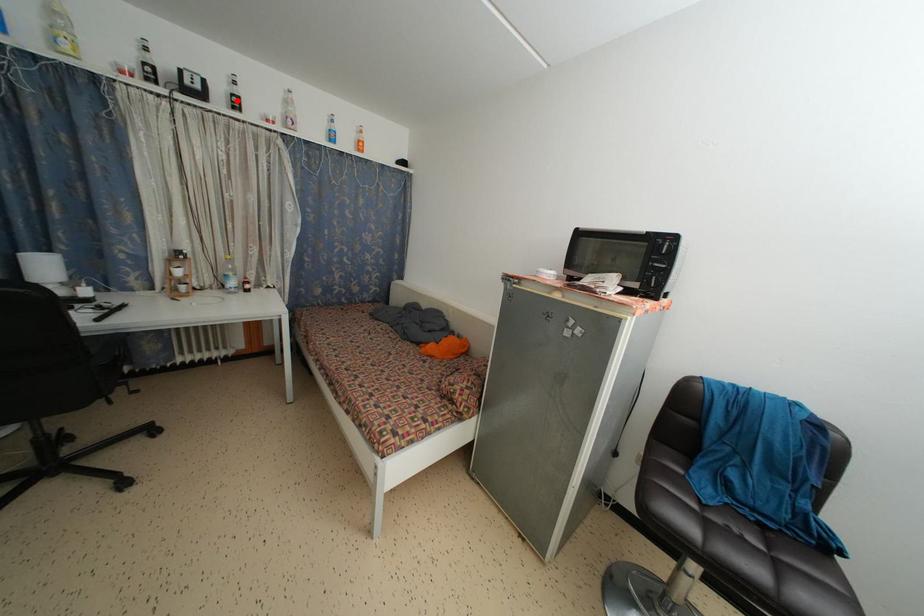
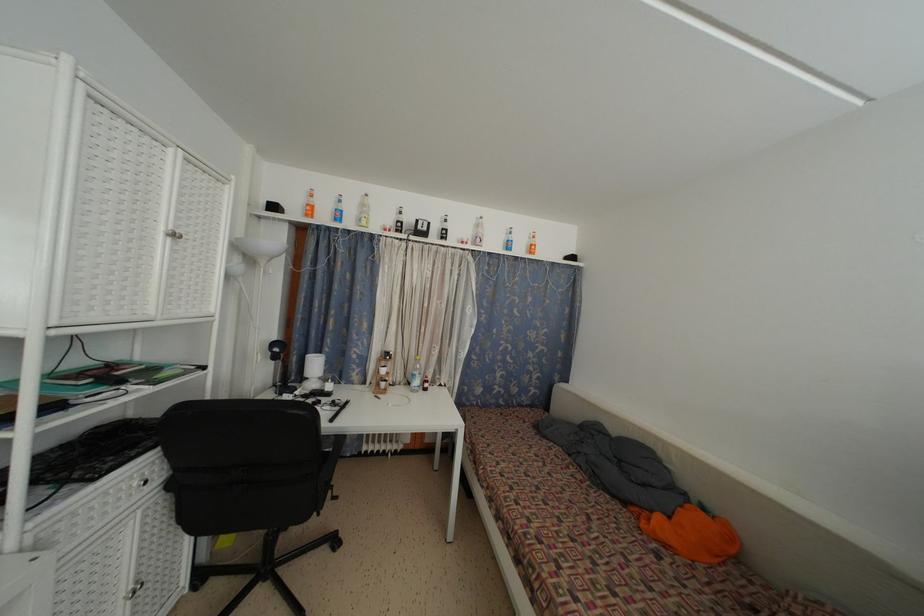
Where in the second image is the point corresponding to the highlighted location from the first image?

(446, 235)